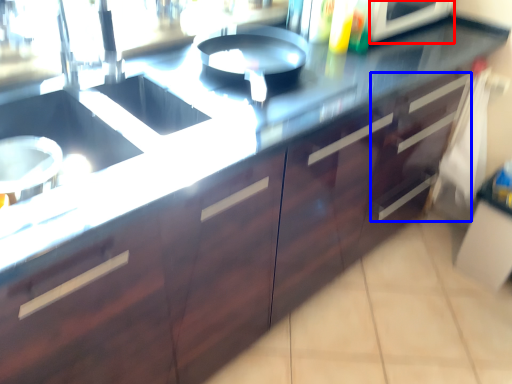
Question: Among these objects, which one is farthest to the camera, appliance (highlighted by a red box) or drawer (highlighted by a blue box)?

Choices:
 (A) appliance
 (B) drawer

Answer: (B)